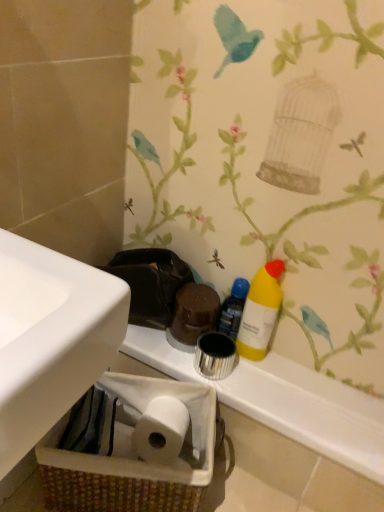
Question: Considering the relative sizes of yellow matte bottle at right and brown woven basket at lower left in the image provided, is yellow matte bottle at right smaller than brown woven basket at lower left?

Choices:
 (A) yes
 (B) no

Answer: (A)

Question: Is yellow matte bottle at right to the right of brown woven basket at lower left from the viewer's perspective?

Choices:
 (A) no
 (B) yes

Answer: (B)

Question: Considering the relative sizes of yellow matte bottle at right and brown woven basket at lower left in the image provided, is yellow matte bottle at right shorter than brown woven basket at lower left?

Choices:
 (A) no
 (B) yes

Answer: (B)

Question: Is yellow matte bottle at right taller than brown woven basket at lower left?

Choices:
 (A) no
 (B) yes

Answer: (A)

Question: Is yellow matte bottle at right positioned with its back to brown woven basket at lower left?

Choices:
 (A) no
 (B) yes

Answer: (A)

Question: Considering the relative positions of yellow matte bottle at right and brown woven basket at lower left in the image provided, is yellow matte bottle at right in front of brown woven basket at lower left?

Choices:
 (A) no
 (B) yes

Answer: (A)

Question: Is brown woven basket at lower left placed right next to yellow matte bottle at right?

Choices:
 (A) no
 (B) yes

Answer: (A)

Question: Is brown woven basket at lower left at the right side of yellow matte bottle at right?

Choices:
 (A) yes
 (B) no

Answer: (B)

Question: Is brown woven basket at lower left aimed at yellow matte bottle at right?

Choices:
 (A) no
 (B) yes

Answer: (A)

Question: Is brown woven basket at lower left at the left side of yellow matte bottle at right?

Choices:
 (A) yes
 (B) no

Answer: (A)

Question: Does brown woven basket at lower left have a greater width compared to yellow matte bottle at right?

Choices:
 (A) no
 (B) yes

Answer: (B)

Question: Is brown woven basket at lower left positioned far away from yellow matte bottle at right?

Choices:
 (A) no
 (B) yes

Answer: (A)

Question: Would you say white glossy counter top at center is part of yellow matte bottle at center right's contents?

Choices:
 (A) yes
 (B) no

Answer: (B)